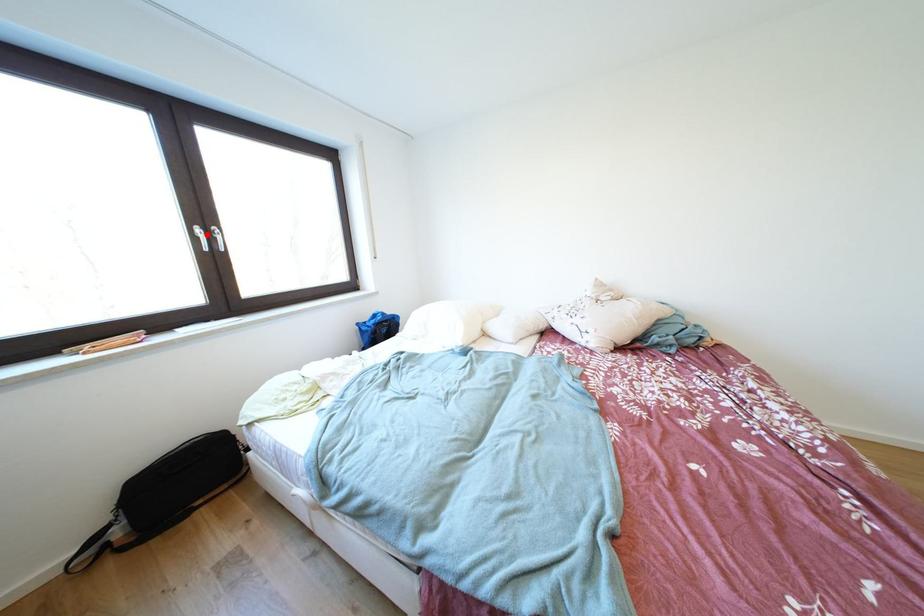
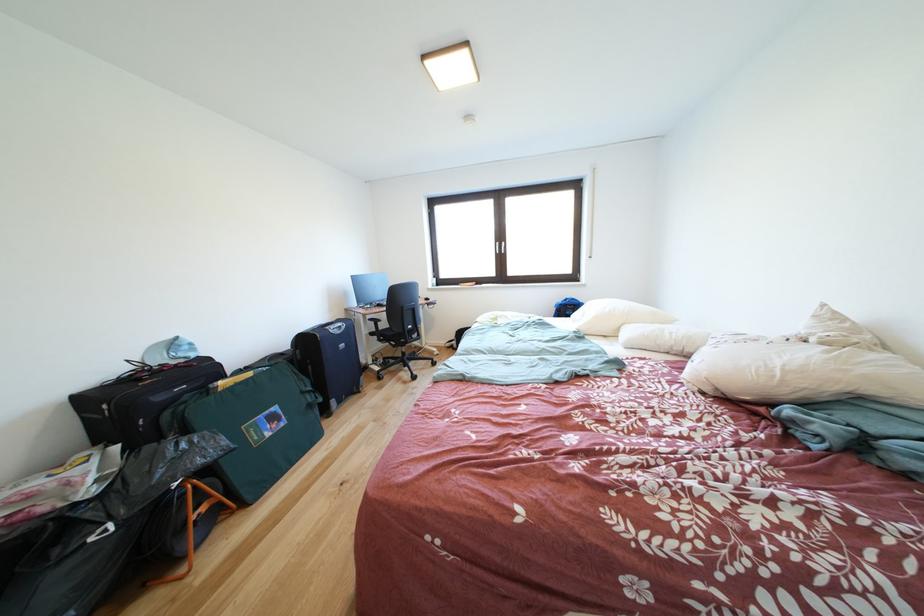
Question: I am providing you with two images of the same scene from different viewpoints. Given a red point in image1, look at the same physical point in image2. Is it:

Choices:
 (A) Closer to the viewpoint
 (B) Farther from the viewpoint

Answer: (A)